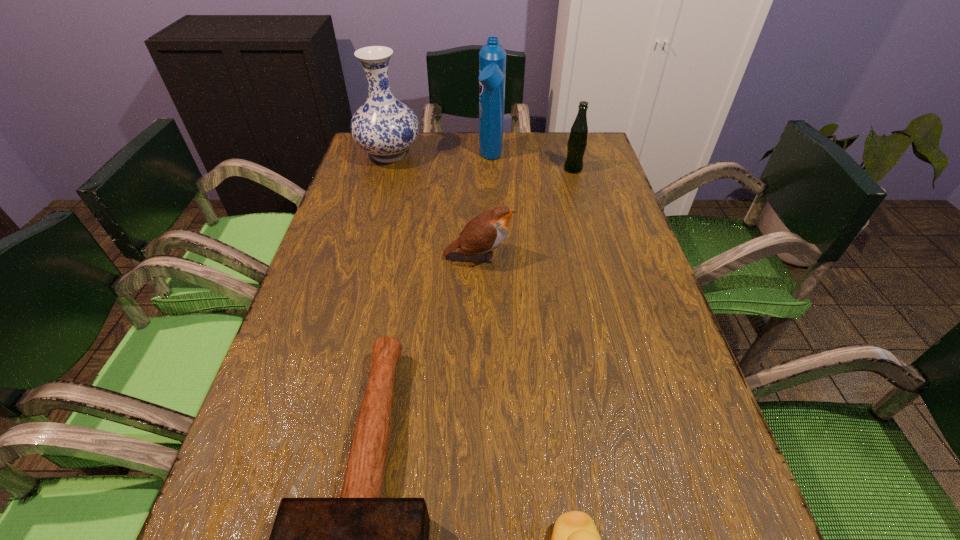
You are a GUI agent. You are given a task and a screenshot of the screen. Output one action in this format:
    pyautogui.click(x=<x>, y=<y>)
    Task: Click on the shampoo at the far edge
    This screenshot has width=960, height=540.
    Given the screenshot: What is the action you would take?
    pyautogui.click(x=492, y=57)

Find the location of `vase that is at the far edge`. vase that is at the far edge is located at coordinates (383, 126).

Locate an element on the screen. beer bottle present at the far edge is located at coordinates (577, 142).

This screenshot has width=960, height=540. What are the coordinates of `object that is at the left edge` in the screenshot? It's located at (383, 126).

You are a GUI agent. You are given a task and a screenshot of the screen. Output one action in this format:
    pyautogui.click(x=<x>, y=<y>)
    Task: Click on the object situated at the right edge
    This screenshot has width=960, height=540.
    Given the screenshot: What is the action you would take?
    pyautogui.click(x=577, y=142)

Find the location of a particular element. The width and height of the screenshot is (960, 540). object positioned at the far left corner is located at coordinates click(383, 126).

Image resolution: width=960 pixels, height=540 pixels. I want to click on object located in the far right corner section of the desktop, so click(577, 142).

Image resolution: width=960 pixels, height=540 pixels. What are the coordinates of `blank space at the far edge of the desktop` in the screenshot? It's located at (468, 149).

This screenshot has height=540, width=960. What are the coordinates of `vacant region at the left edge` in the screenshot? It's located at (361, 179).

In order to click on vacant space at the right edge of the desktop in this screenshot , I will do tap(638, 303).